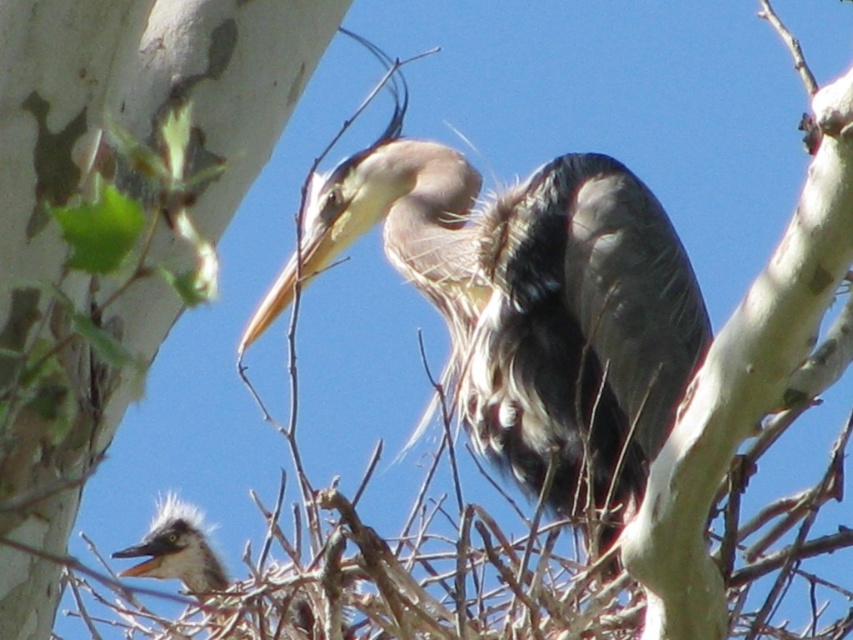
You are a birdwatcher observing the two birds in the tree. Which bird is closer to you, the gray feathered heron at center or the speckled gray bird at center?

The gray feathered heron at center is closer to you because the speckled gray bird at center is behind it.

You are a birdwatcher trying to locate the gray feathered heron at center in the image. The coordinates provided are in a normalized format where the top left corner is the origin. Can you confirm if the point at (531, 307) is the correct location for the gray feathered heron at center?

Yes, the point at (531, 307) marks the location of the gray feathered heron at center as stated in the description.